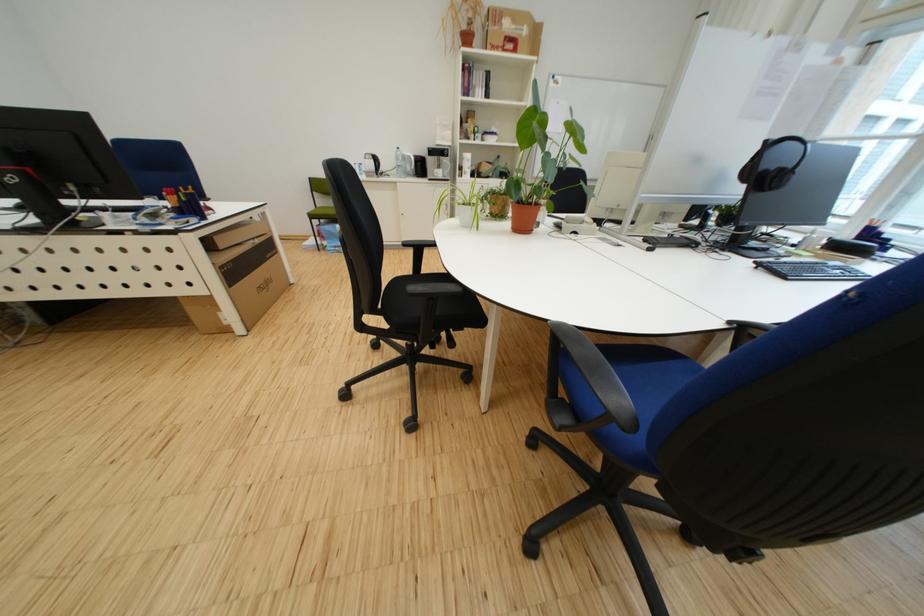
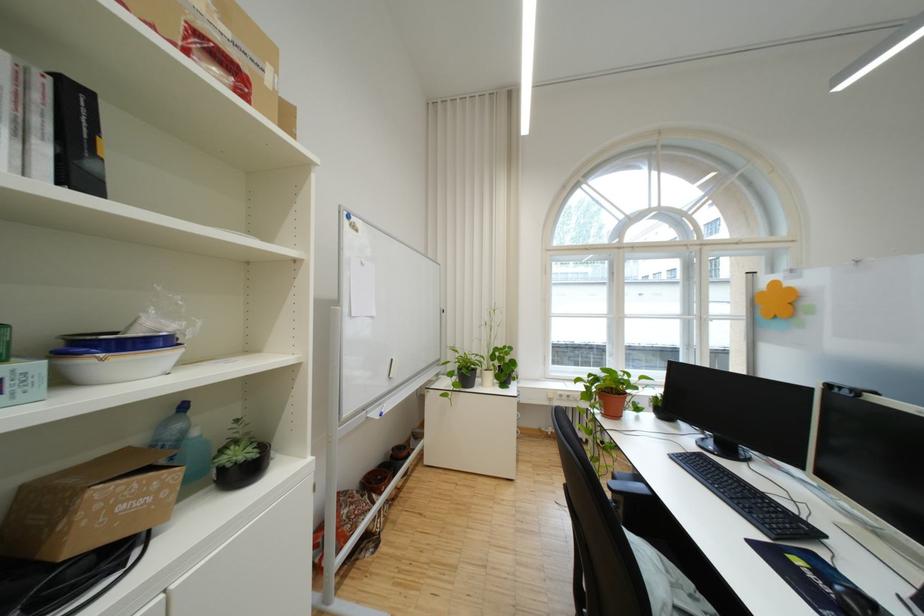
Locate, in the second image, the point that corresponds to the point at 499,140 in the first image.

(117, 365)